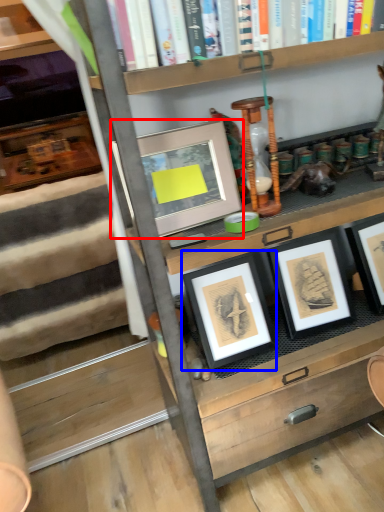
Question: Which point is further to the camera, picture frame (highlighted by a red box) or picture frame (highlighted by a blue box)?

Choices:
 (A) picture frame
 (B) picture frame

Answer: (B)